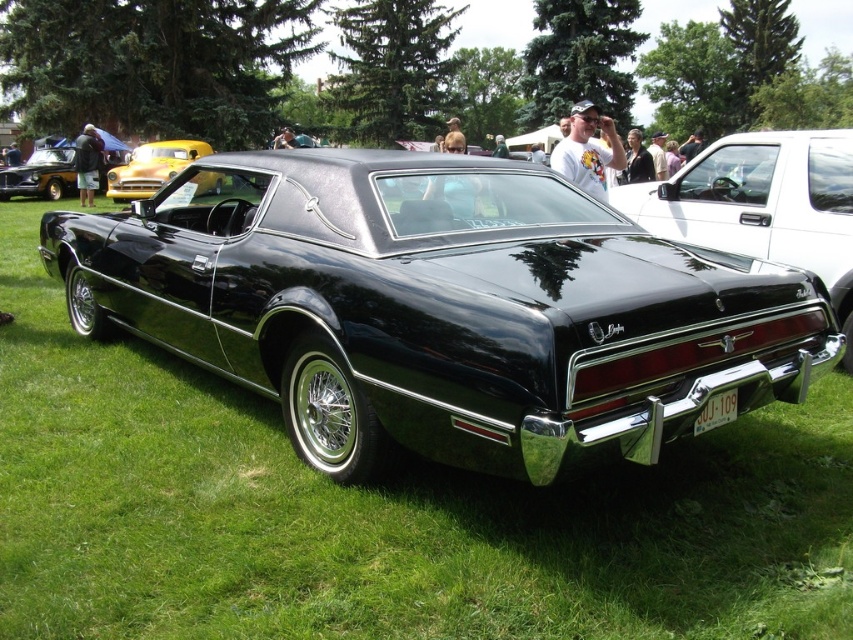
Question: Does glossy black muscle car at center come in front of yellow glossy car at upper left?

Choices:
 (A) yes
 (B) no

Answer: (A)

Question: Is glossy black muscle car at center thinner than glossy black car at center?

Choices:
 (A) yes
 (B) no

Answer: (B)

Question: Considering the real-world distances, which object is farthest from the matte gold car at left?

Choices:
 (A) glossy black car at center
 (B) glossy black muscle car at center
 (C) yellow glossy car at upper left

Answer: (A)

Question: Does glossy black car at center come in front of yellow glossy car at upper left?

Choices:
 (A) no
 (B) yes

Answer: (A)

Question: Which point is closer to the camera?

Choices:
 (A) (827, 218)
 (B) (666, 312)

Answer: (B)

Question: Based on their relative distances, which object is nearer to the glossy black car at center?

Choices:
 (A) yellow glossy car at upper left
 (B) glossy black muscle car at center

Answer: (B)